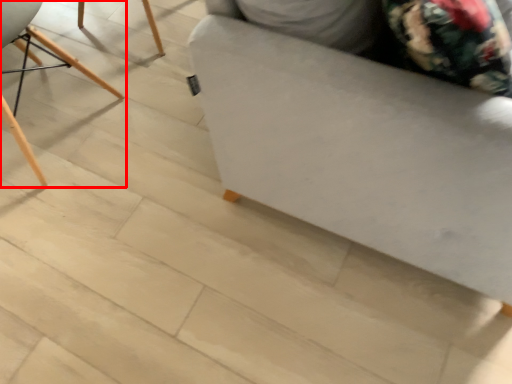
Question: Observing the image, what is the correct spatial positioning of chair (annotated by the red box) in reference to furniture?

Choices:
 (A) left
 (B) right

Answer: (A)